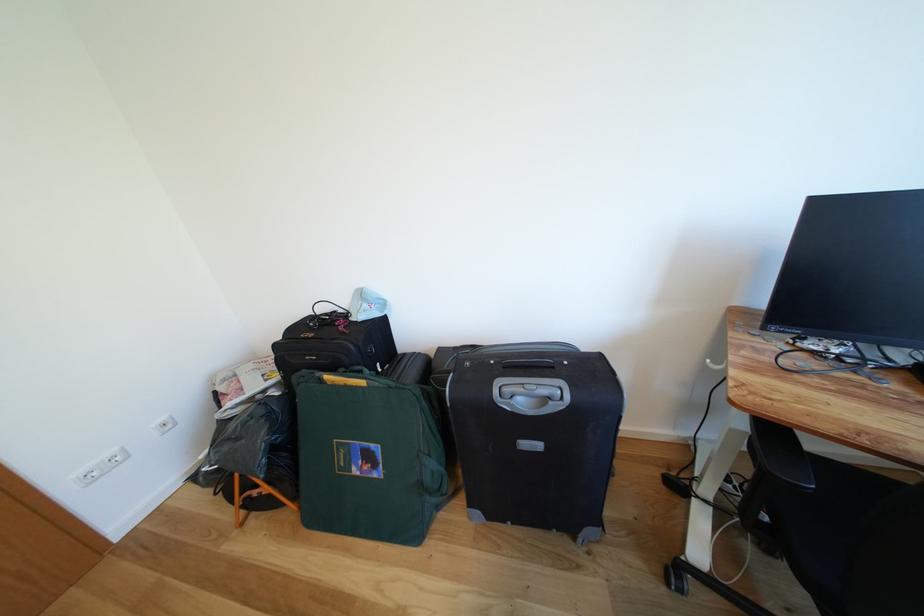
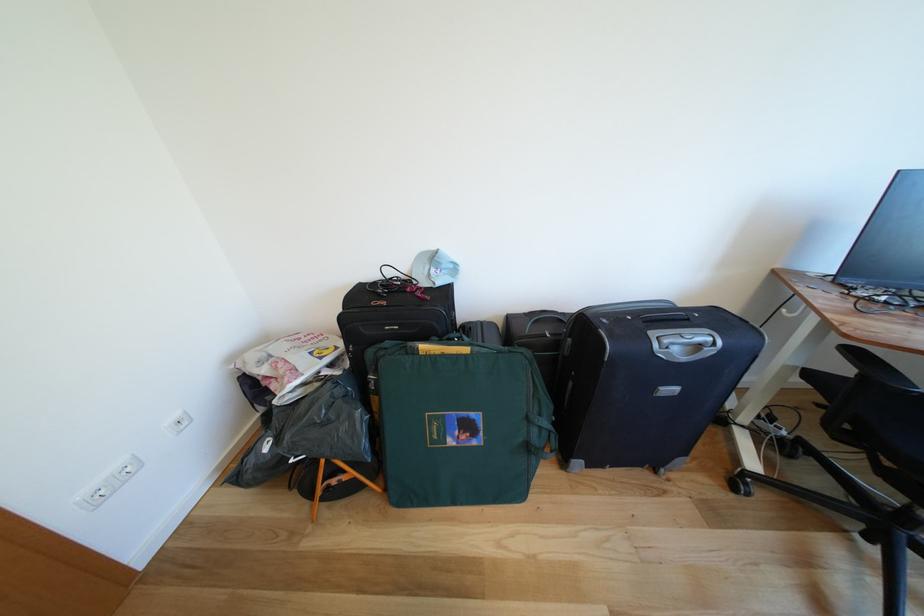
In the second image, find the point that corresponds to (x=553, y=403) in the first image.

(707, 351)